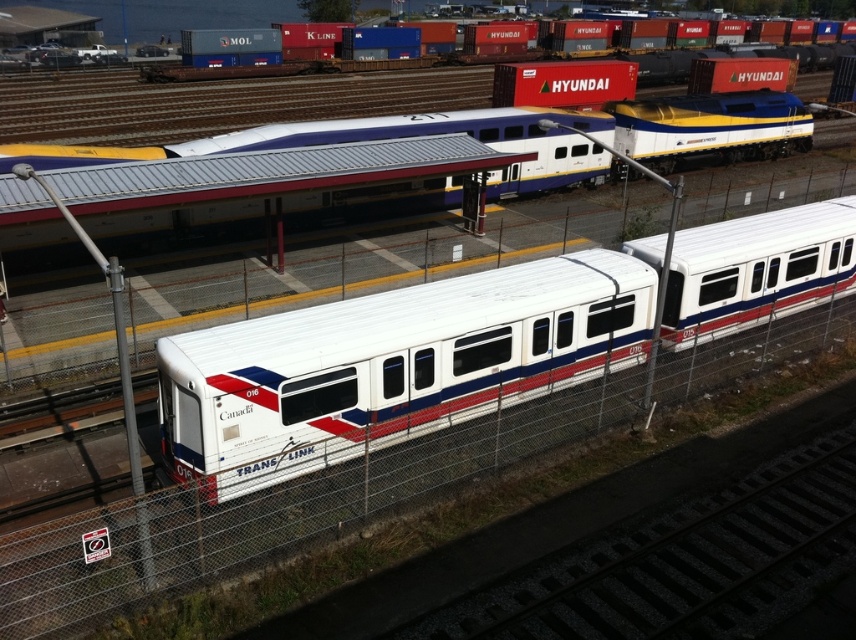
Question: Can you confirm if white glossy passenger train at center is bigger than matte white train at upper center?

Choices:
 (A) yes
 (B) no

Answer: (B)

Question: Does white glossy passenger train at center have a greater width compared to matte white train at upper center?

Choices:
 (A) yes
 (B) no

Answer: (B)

Question: Which object appears farthest from the camera in this image?

Choices:
 (A) white glossy train at center
 (B) matte white train at upper center

Answer: (B)

Question: Does white glossy passenger train at center have a greater width compared to white glossy train at center?

Choices:
 (A) no
 (B) yes

Answer: (A)

Question: Estimate the real-world distances between objects in this image. Which object is closer to the matte white train at upper center?

Choices:
 (A) white glossy train at center
 (B) white glossy passenger train at center

Answer: (A)

Question: Among these objects, which one is farthest from the camera?

Choices:
 (A) white glossy passenger train at center
 (B) matte white train at upper center
 (C) white glossy train at center

Answer: (B)